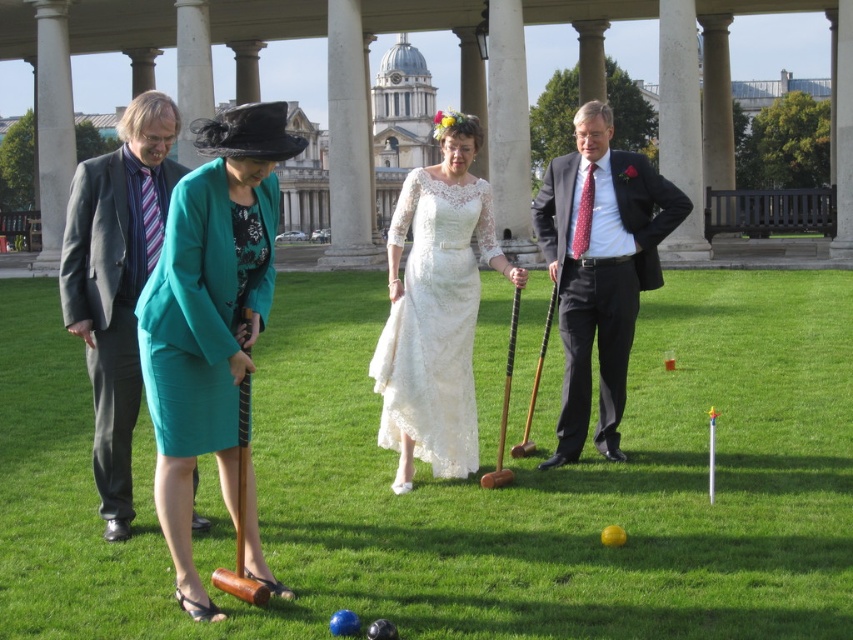
You are playing croquet and need to hit the ball towards the nearest hoop. The wooden croquet mallets at center are located at point (466, 484). Where should you aim to hit the ball?

You should aim to hit the ball towards the nearest hoop, which is located at point (466, 484) where the wooden croquet mallets at center are situated.

You are planning to rent a costume for a historical reenactment event. You see two options in the image, the dark gray suit at right and the teal fabric dress at center. Which costume has a larger size?

The dark gray suit at right is bigger than the teal fabric dress at center, so the dark gray suit at right has a larger size.

You are a photographer trying to capture a photo of the gray suit at left and the wooden croquet mallets at center. Based on their positions, which object is higher in the image?

The wooden croquet mallets at center are higher in the image than the gray suit at left because the wooden croquet mallets at center is above gray suit at left.